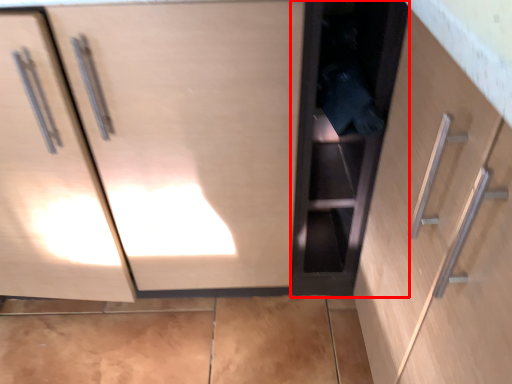
Question: From the image's perspective, where is cabinetry (annotated by the red box) located relative to cabinetry?

Choices:
 (A) below
 (B) above

Answer: (A)